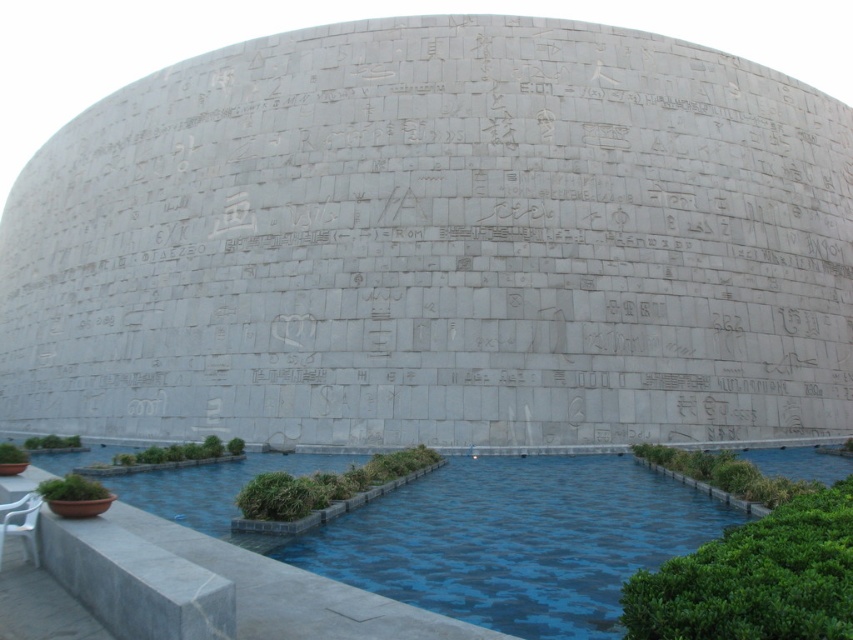
Is blue concrete pool at lower center to the left of white plastic chair at lower left from the viewer's perspective?

In fact, blue concrete pool at lower center is to the right of white plastic chair at lower left.

Is blue concrete pool at lower center closer to camera compared to white plastic chair at lower left?

Yes, blue concrete pool at lower center is in front of white plastic chair at lower left.

This screenshot has width=853, height=640. Describe the element at coordinates (473, 532) in the screenshot. I see `blue concrete pool at lower center` at that location.

This screenshot has width=853, height=640. I want to click on blue concrete pool at lower center, so click(473, 532).